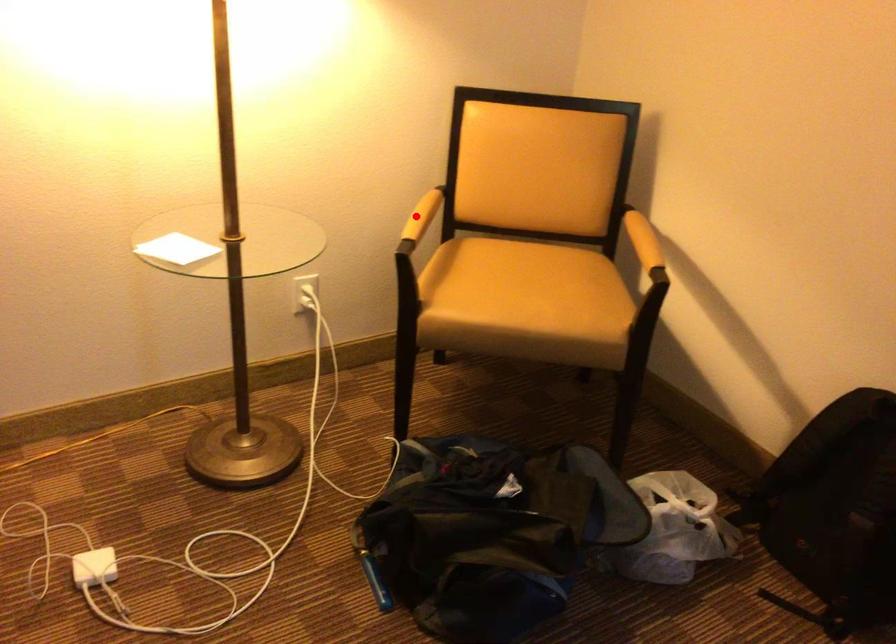
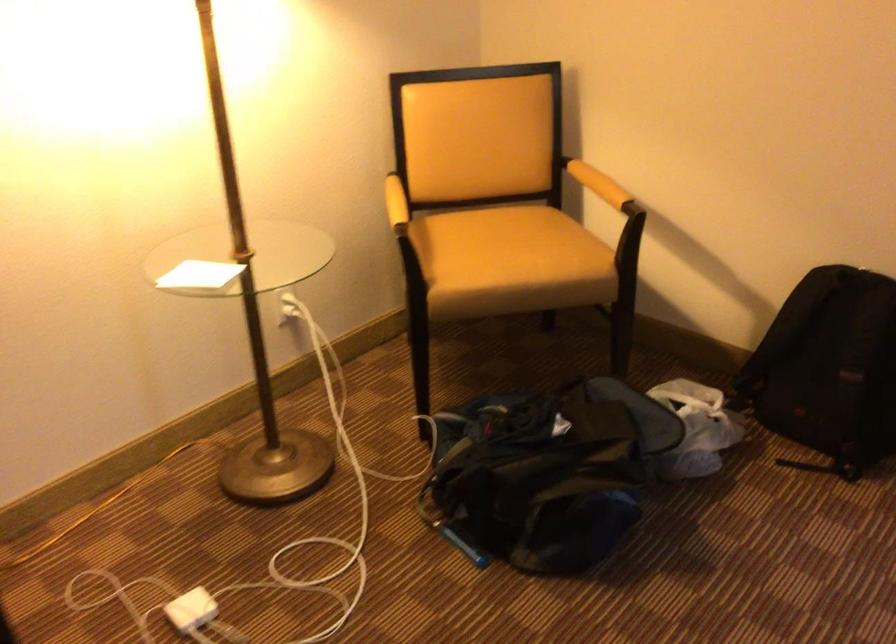
In the second image, find the point that corresponds to the highlighted location in the first image.

(395, 203)